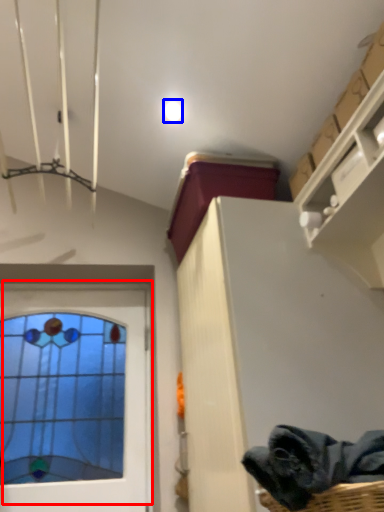
Question: Among these objects, which one is nearest to the camera, window (highlighted by a red box) or droplight (highlighted by a blue box)?

Choices:
 (A) window
 (B) droplight

Answer: (A)